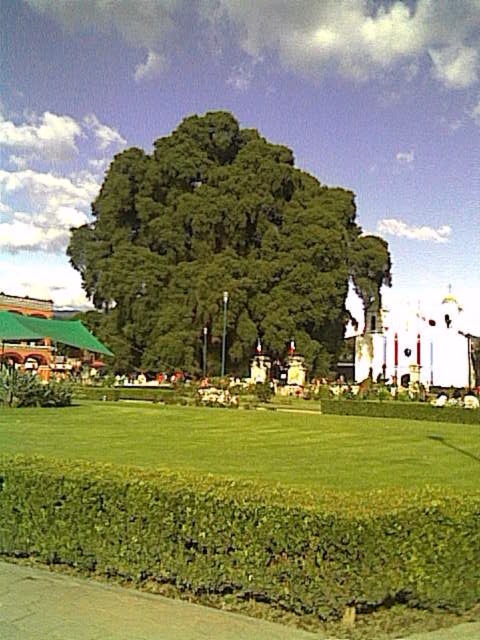
Question: Among these points, which one is farthest from the camera?

Choices:
 (A) (97, 429)
 (B) (108, 481)
 (C) (175, 189)

Answer: (C)

Question: Which point is farther to the camera?

Choices:
 (A) (406, 572)
 (B) (303, 449)

Answer: (B)

Question: Is green leafy hedge at lower center further to camera compared to green grass at lower center?

Choices:
 (A) yes
 (B) no

Answer: (B)

Question: Which point is closer to the camera taking this photo?

Choices:
 (A) (123, 536)
 (B) (317, 483)

Answer: (A)

Question: Can you confirm if green leafy hedge at lower center is bigger than green grass at lower center?

Choices:
 (A) yes
 (B) no

Answer: (B)

Question: Does green leafy hedge at lower center appear on the right side of green grass at lower center?

Choices:
 (A) yes
 (B) no

Answer: (A)